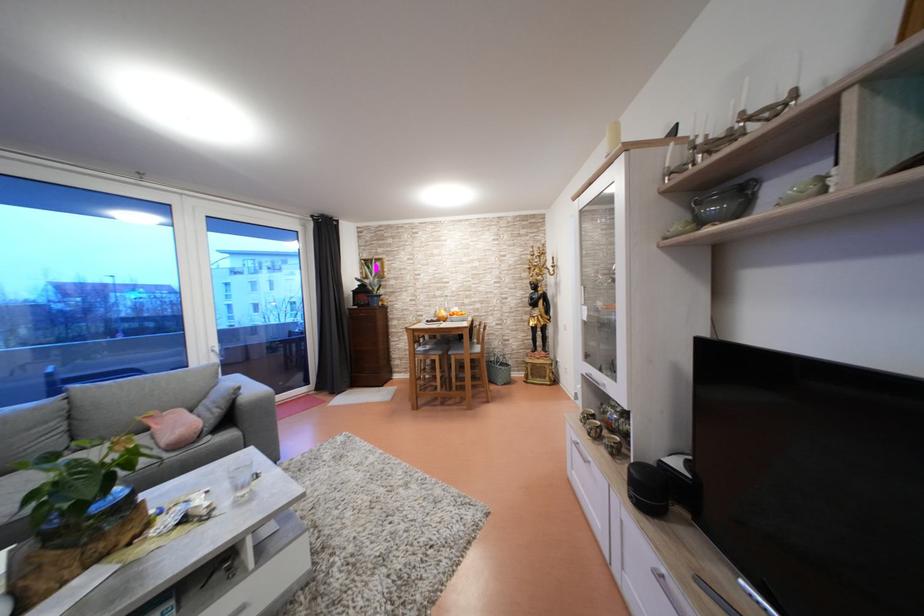
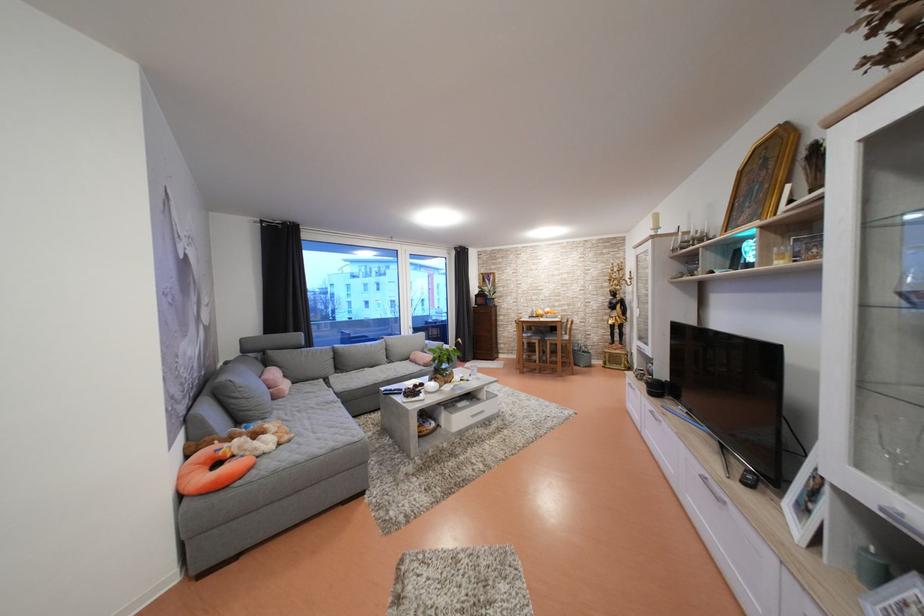
Find the pixel in the second image that matches [446,358] in the first image.

(545, 342)